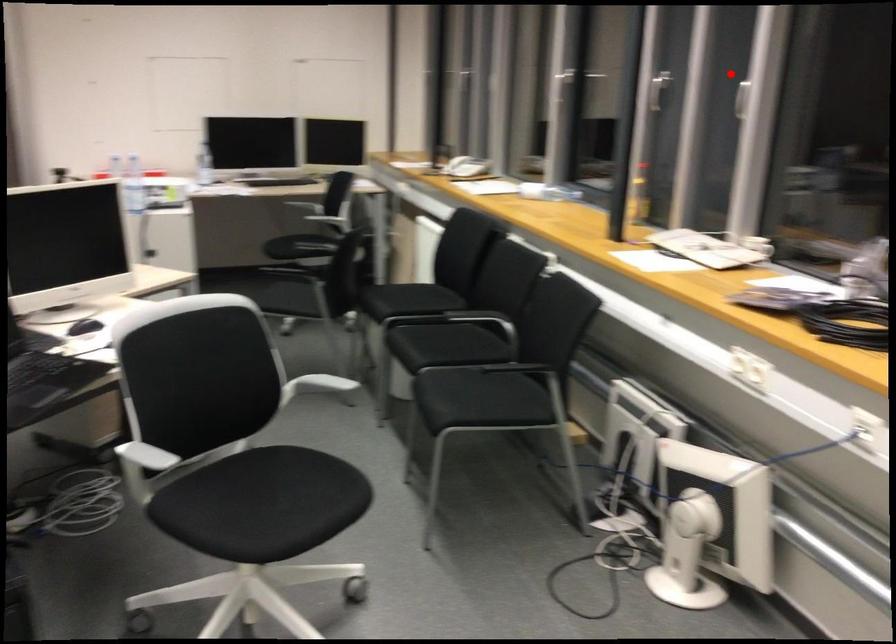
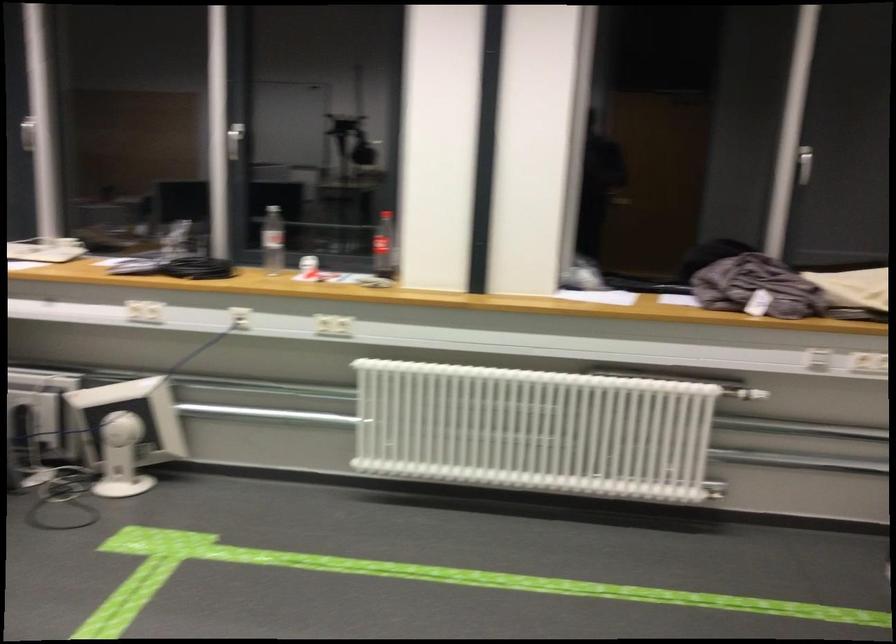
In the second image, find the point that corresponds to the highlighted location in the first image.

(27, 134)